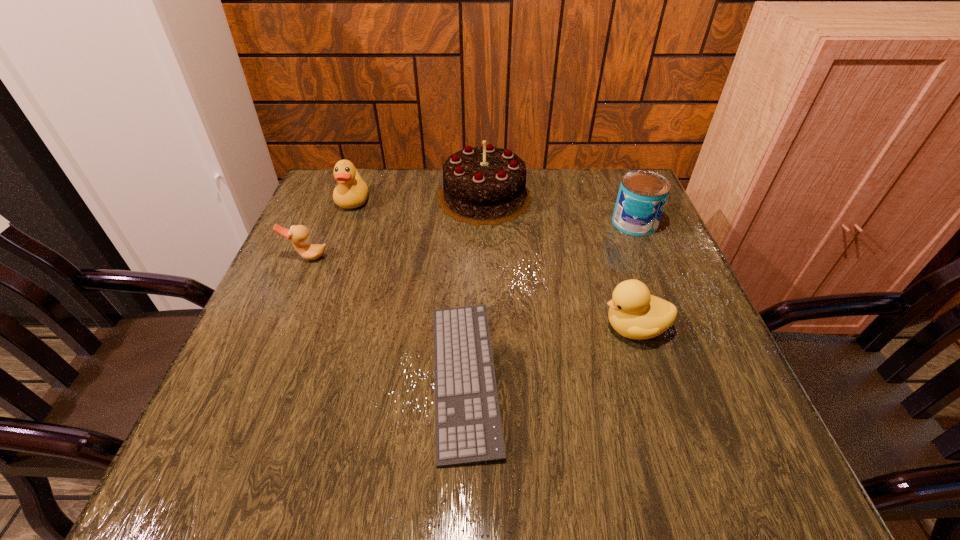
This screenshot has width=960, height=540. I want to click on free space between the tallest object and the nearest duck, so click(x=560, y=262).

Locate an element on the screen. This screenshot has height=540, width=960. free space between the farthest duck and the shortest object is located at coordinates (409, 288).

Where is `free space between the shortest duck and the nearest duck`? free space between the shortest duck and the nearest duck is located at coordinates (471, 293).

Where is `vacant space in between the second shortest object and the rightmost duck`? vacant space in between the second shortest object and the rightmost duck is located at coordinates (471, 293).

At what (x,y) coordinates should I click in order to perform the action: click on vacant area that lies between the birthday cake and the computer keyboard. Please return your answer as a coordinate pair (x, y). The height and width of the screenshot is (540, 960). Looking at the image, I should click on (474, 287).

This screenshot has height=540, width=960. I want to click on vacant area that lies between the can and the tallest object, so click(560, 210).

Locate an element on the screen. unoccupied position between the birthday cake and the can is located at coordinates (560, 210).

Locate an element on the screen. object identified as the fifth closest to the can is located at coordinates (298, 234).

The height and width of the screenshot is (540, 960). Find the location of `object that ranks as the closest to the shortest object`. object that ranks as the closest to the shortest object is located at coordinates (634, 313).

Find the location of a particular element. the second closest duck to the tallest object is located at coordinates (298, 234).